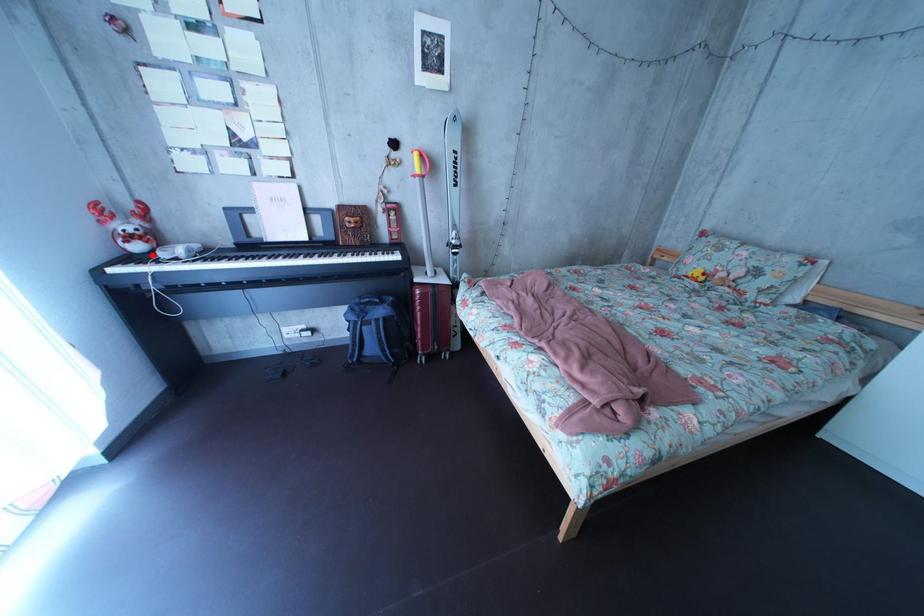
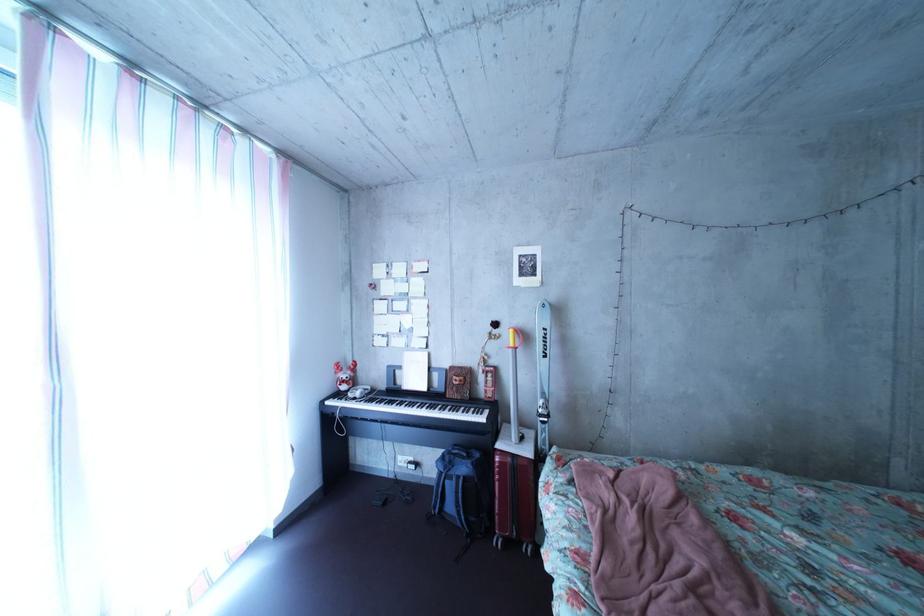
Locate, in the second image, the point that corresponds to the highlighted location in the first image.

(358, 395)